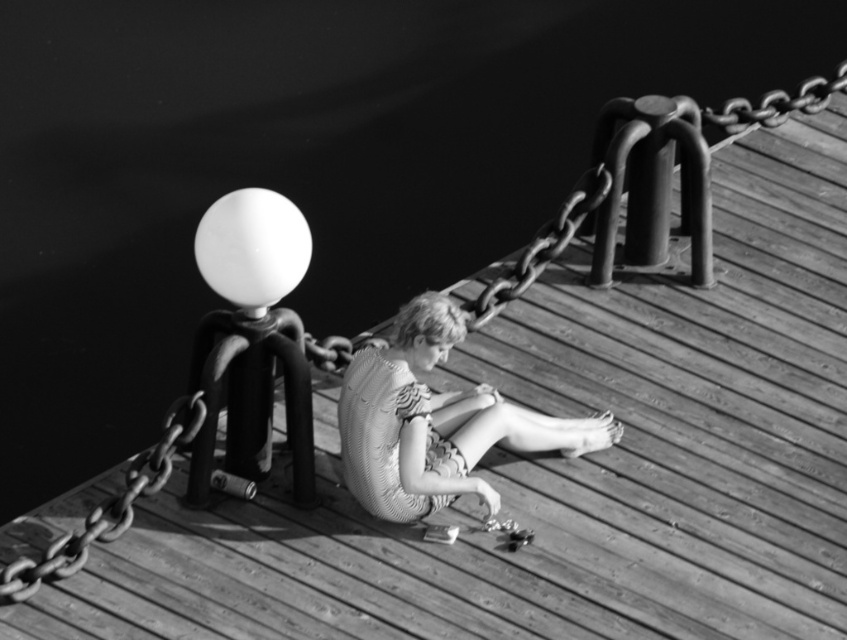
Can you confirm if white matte balloon at upper center is shorter than metallic chain at upper right?

Indeed, white matte balloon at upper center has a lesser height compared to metallic chain at upper right.

The width and height of the screenshot is (847, 640). I want to click on white matte balloon at upper center, so click(252, 248).

Between white matte balloon at upper center and metallic chain at left, which one appears on the left side from the viewer's perspective?

From the viewer's perspective, metallic chain at left appears more on the left side.

Is white matte balloon at upper center positioned at the back of metallic chain at left?

Yes, it is.

This screenshot has height=640, width=847. I want to click on white matte balloon at upper center, so point(252,248).

Does knitted fabric dress at center have a larger size compared to metallic chain at upper right?

Yes.

From the picture: Is knitted fabric dress at center taller than metallic chain at upper right?

Indeed, knitted fabric dress at center has a greater height compared to metallic chain at upper right.

Between point (435, 401) and point (475, 300), which one is positioned in front?

Point (435, 401) is in front.

Where is `knitted fabric dress at center`? knitted fabric dress at center is located at coordinates (435, 420).